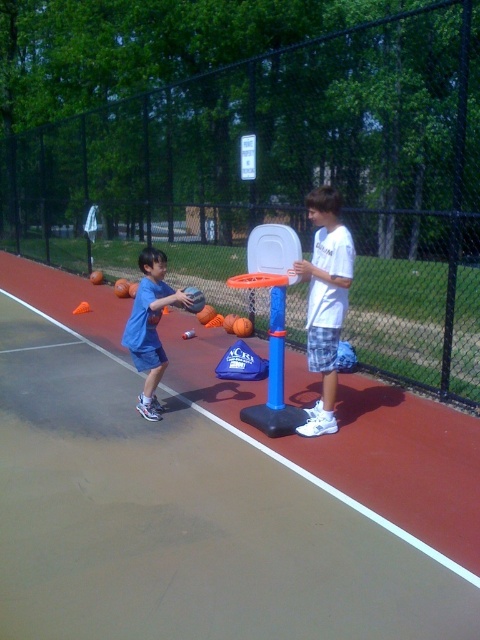
Is smooth concrete court at center taller than blue matte shorts at left?

In fact, smooth concrete court at center may be shorter than blue matte shorts at left.

Does smooth concrete court at center have a lesser width compared to blue matte shorts at left?

Indeed, smooth concrete court at center has a lesser width compared to blue matte shorts at left.

Which is behind, point (324, 611) or point (158, 342)?

Positioned behind is point (158, 342).

Where is `smooth concrete court at center`? The image size is (480, 640). smooth concrete court at center is located at coordinates (201, 497).

From the picture: Is smooth concrete court at center closer to camera compared to white cotton shirt at center?

No, smooth concrete court at center is behind white cotton shirt at center.

Can you confirm if smooth concrete court at center is bigger than white cotton shirt at center?

Actually, smooth concrete court at center might be smaller than white cotton shirt at center.

Does point (35, 572) come closer to viewer compared to point (339, 323)?

Yes, point (35, 572) is closer to viewer.

Locate an element on the screen. This screenshot has height=640, width=480. smooth concrete court at center is located at coordinates (201, 497).

Is point (325, 214) positioned after point (146, 378)?

That is False.

Between point (307, 339) and point (140, 333), which one is positioned in front?

Point (140, 333)

Describe the element at coordinates (325, 301) in the screenshot. The image size is (480, 640). I see `white cotton shirt at center` at that location.

Image resolution: width=480 pixels, height=640 pixels. I want to click on white cotton shirt at center, so click(325, 301).